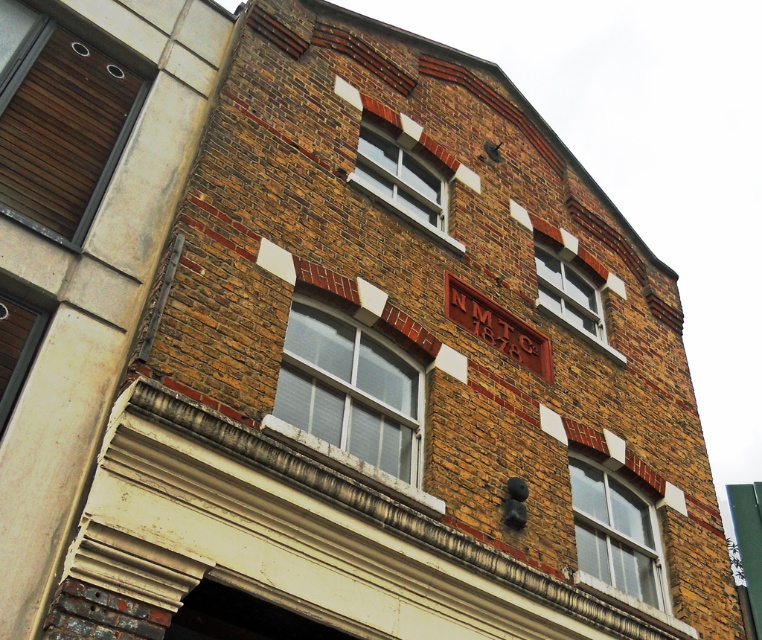
Question: From the image, what is the correct spatial relationship of brown wooden window at upper left in relation to white painted wood window at upper center?

Choices:
 (A) below
 (B) above

Answer: (B)

Question: Among these objects, which one is nearest to the camera?

Choices:
 (A) brown wooden window at upper left
 (B) matte white window at center

Answer: (A)

Question: Can you confirm if clear glass window at center right is bigger than matte white window at center?

Choices:
 (A) yes
 (B) no

Answer: (A)

Question: Among these points, which one is nearest to the camera?

Choices:
 (A) (570, 280)
 (B) (379, 467)
 (C) (11, 380)
 (D) (399, 209)

Answer: (C)

Question: Considering the real-world distances, which object is closest to the clear glass window at center?

Choices:
 (A) matte white window at center
 (B) white painted wood window at upper center

Answer: (A)

Question: Does matte white window at center have a greater width compared to matte glass window at left?

Choices:
 (A) yes
 (B) no

Answer: (A)